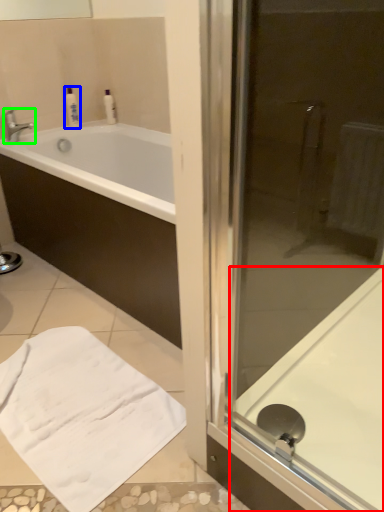
Question: Which object is the farthest from bath (highlighted by a red box)? Choose among these: toiletry (highlighted by a blue box) or tap (highlighted by a green box).

Choices:
 (A) toiletry
 (B) tap

Answer: (A)